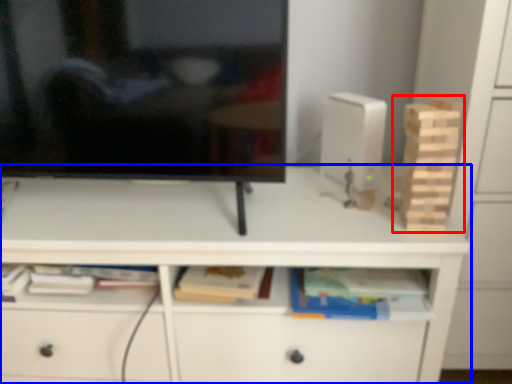
Question: Which object appears closest to the camera in this image, toy (highlighted by a red box) or desk (highlighted by a blue box)?

Choices:
 (A) toy
 (B) desk

Answer: (A)